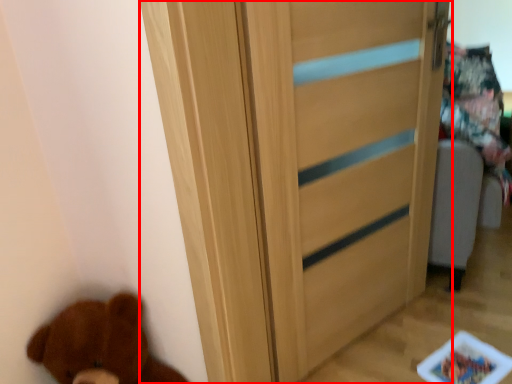
Question: From the image's perspective, what is the correct spatial relationship of door (annotated by the red box) in relation to brown bear?

Choices:
 (A) above
 (B) below

Answer: (A)